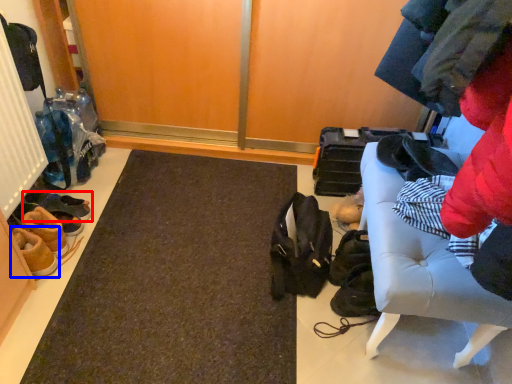
Question: Among these objects, which one is farthest to the camera, footwear (highlighted by a red box) or footwear (highlighted by a blue box)?

Choices:
 (A) footwear
 (B) footwear

Answer: (A)